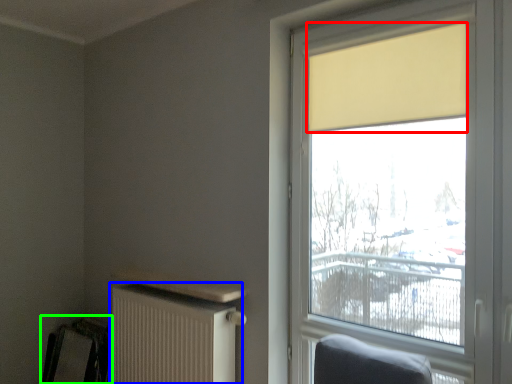
Question: Based on their relative distances, which object is farther from curtain (highlighted by a red box)? Choose from radiator (highlighted by a blue box) and swivel chair (highlighted by a green box).

Choices:
 (A) radiator
 (B) swivel chair

Answer: (B)